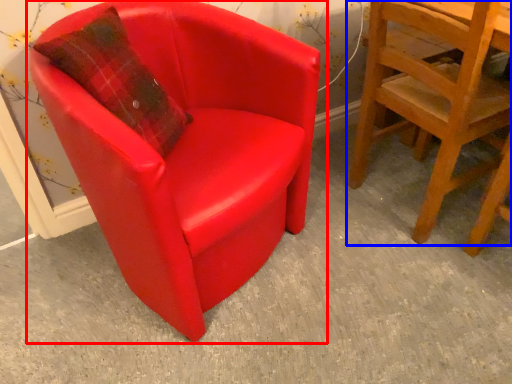
Question: Which object appears farthest to the camera in this image, chair (highlighted by a red box) or chair (highlighted by a blue box)?

Choices:
 (A) chair
 (B) chair

Answer: (B)